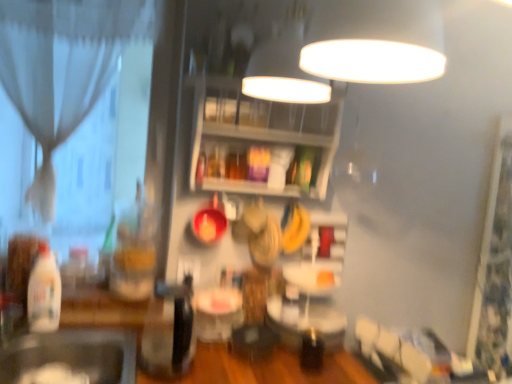
Question: From a real-world perspective, is translucent glass jar at center, which is the first bottle in right-to-left order, below white glossy table at center?

Choices:
 (A) yes
 (B) no

Answer: (B)

Question: Is translucent glass jar at center, which is the first bottle in right-to-left order, further to the viewer compared to white glossy table at center?

Choices:
 (A) no
 (B) yes

Answer: (B)

Question: Could you tell me if translucent glass jar at center, marked as the 1th bottle in a back-to-front arrangement, is turned towards white glossy table at center?

Choices:
 (A) no
 (B) yes

Answer: (A)

Question: From a real-world perspective, is translucent glass jar at center, which is the second bottle from front to back, located higher than white glossy table at center?

Choices:
 (A) yes
 (B) no

Answer: (A)

Question: Is translucent glass jar at center, marked as the 1th bottle in a back-to-front arrangement, smaller than white glossy table at center?

Choices:
 (A) yes
 (B) no

Answer: (B)

Question: From a real-world perspective, is translucent glass jar at center, which is counted as the second bottle, starting from the left, above or below translucent plastic bottle at left, the second bottle from the right?

Choices:
 (A) below
 (B) above

Answer: (B)

Question: From the image's perspective, is translucent glass jar at center, marked as the 1th bottle in a back-to-front arrangement, located above or below translucent plastic bottle at left, the second bottle from the right?

Choices:
 (A) above
 (B) below

Answer: (A)

Question: Relative to translucent plastic bottle at left, acting as the 2th bottle starting from the back, is translucent glass jar at center, which is the second bottle from front to back, in front or behind?

Choices:
 (A) front
 (B) behind

Answer: (B)

Question: Looking at their shapes, would you say translucent glass jar at center, which is the second bottle from front to back, is wider or thinner than translucent plastic bottle at left, acting as the 1th bottle starting from the left?

Choices:
 (A) thin
 (B) wide

Answer: (B)

Question: From the image's perspective, is translucent glass jar at center, marked as the 1th bottle in a back-to-front arrangement, positioned above or below wooden shelves at upper center?

Choices:
 (A) below
 (B) above

Answer: (A)

Question: Relative to wooden shelves at upper center, is translucent glass jar at center, which is counted as the second bottle, starting from the left, in front or behind?

Choices:
 (A) front
 (B) behind

Answer: (B)

Question: From their relative heights in the image, would you say translucent glass jar at center, which is the second bottle from front to back, is taller or shorter than wooden shelves at upper center?

Choices:
 (A) short
 (B) tall

Answer: (A)

Question: In terms of width, does translucent glass jar at center, which is the second bottle from front to back, look wider or thinner when compared to wooden shelves at upper center?

Choices:
 (A) wide
 (B) thin

Answer: (B)

Question: Considering the positions of black matte sink at lower left and white glossy table at center in the image, is black matte sink at lower left bigger or smaller than white glossy table at center?

Choices:
 (A) big
 (B) small

Answer: (A)

Question: Do you think black matte sink at lower left is within white glossy table at center, or outside of it?

Choices:
 (A) inside
 (B) outside

Answer: (B)